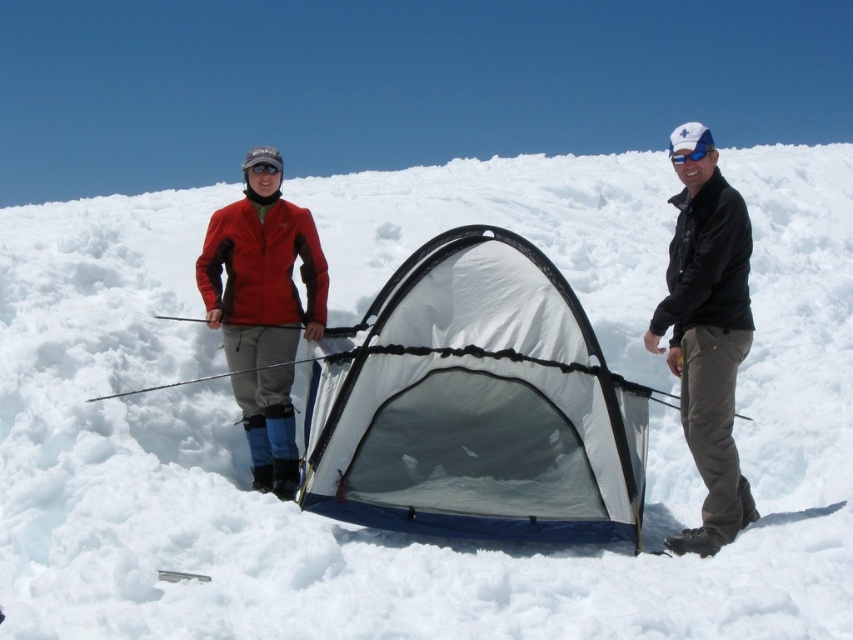
You are a hiker planning to set up a tent in this snowy area. You have a backpack with limited space. Which item should you prioritize packing first between the black leather jacket at right and the blue reflective lens goggles at upper right if you need to carry the taller item?

The black leather jacket at right is taller than the blue reflective lens goggles at upper right, so you should prioritize packing the black leather jacket at right first.

You are planning to set up a tent in this snowy area. You have the black leather jacket at right and the blue reflective lens goggles at upper right. Which item is positioned higher up in the image?

The blue reflective lens goggles at upper right are positioned higher up in the image than the black leather jacket at right.

What object is located at the coordinates point (474, 404) in the image?

The point (474, 404) corresponds to the white mesh tent at center.